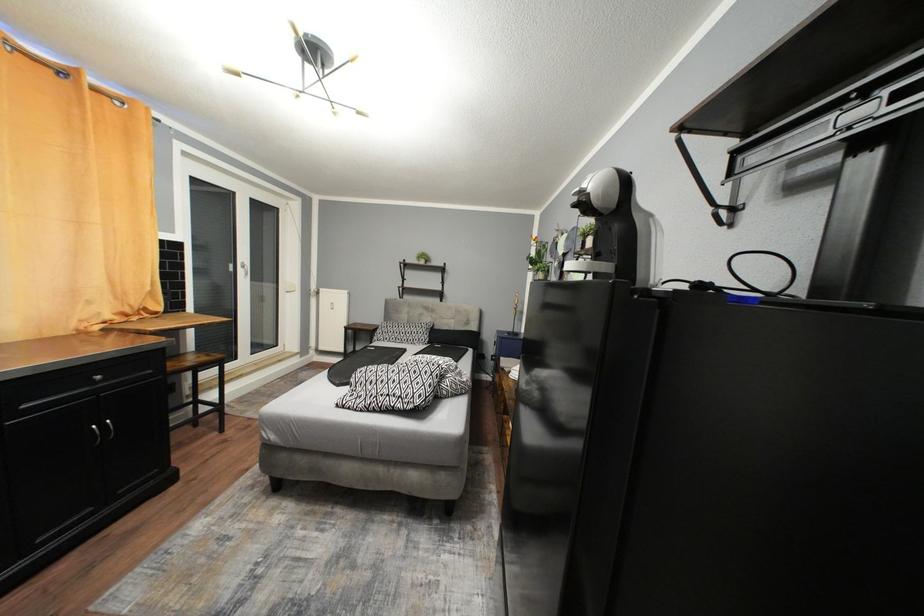
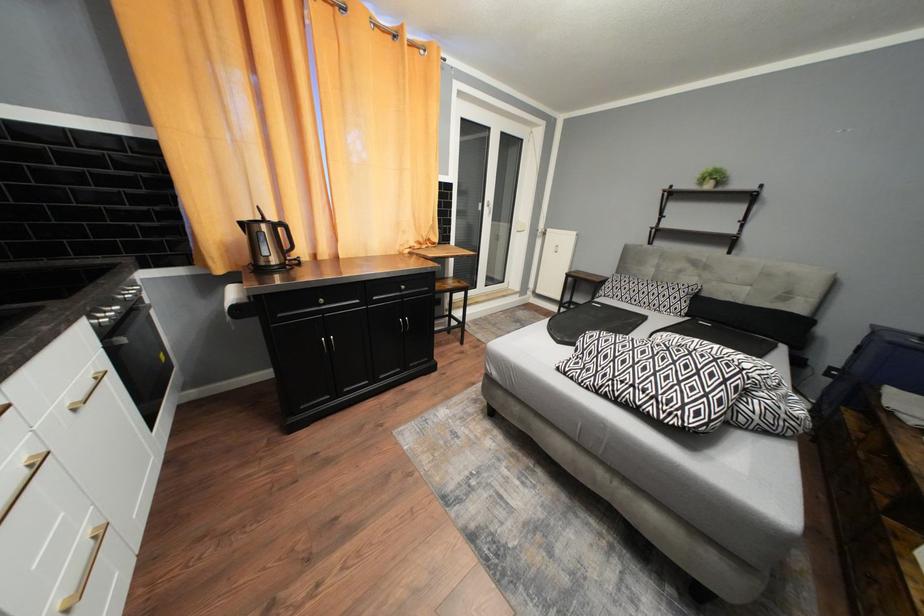
Question: The camera is either moving clockwise (left) or counter-clockwise (right) around the object. The first image is from the beginning of the video and the second image is from the end. Is the camera moving left or right when shooting the video?

Choices:
 (A) Left
 (B) Right

Answer: (B)